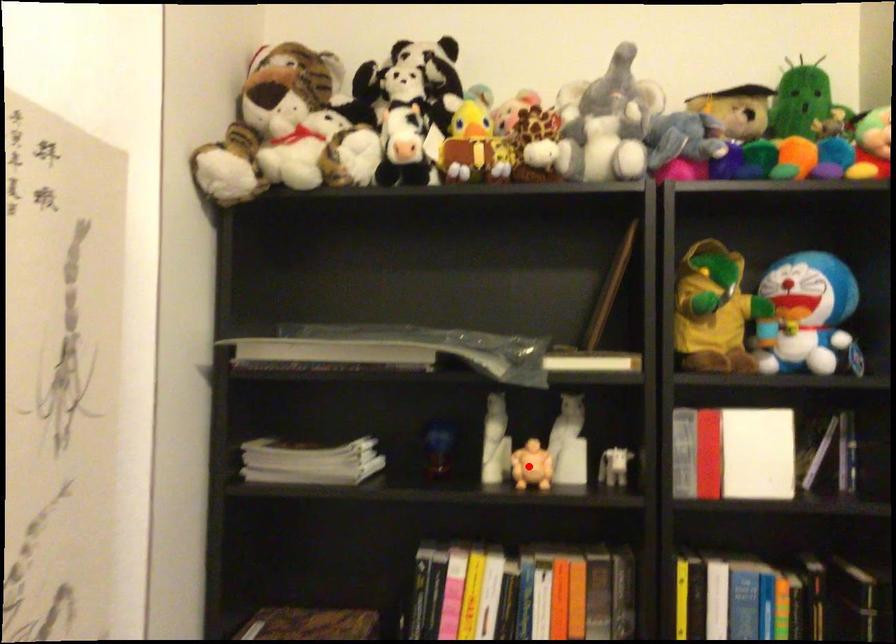
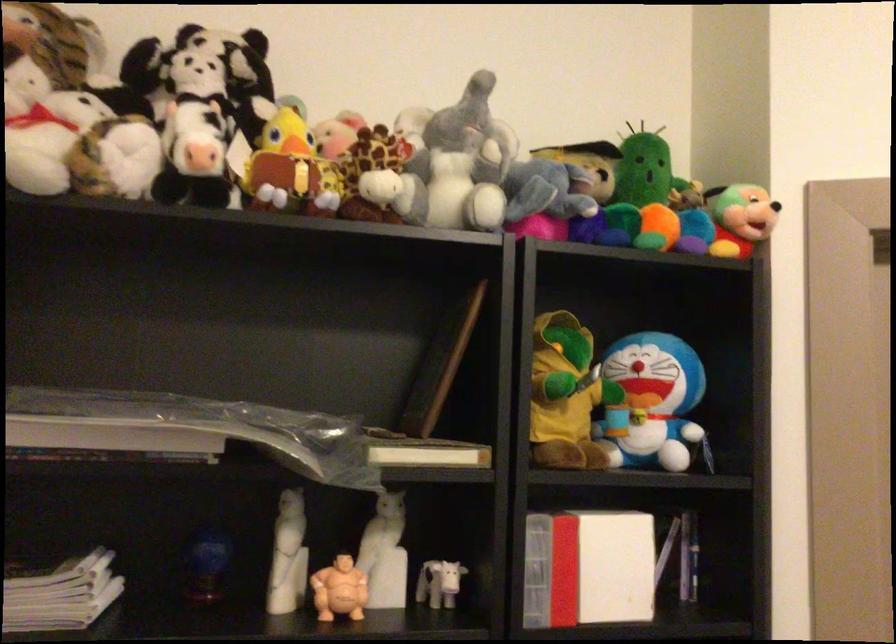
Locate, in the second image, the point that corresponds to the highlighted location in the first image.

(339, 589)